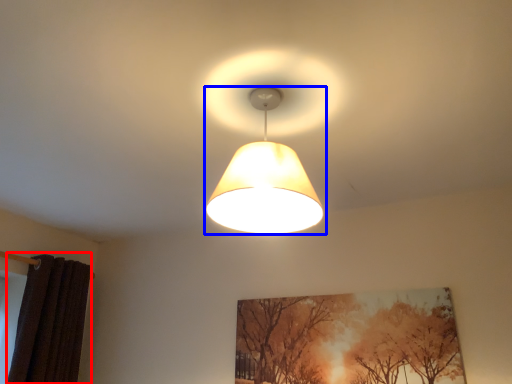
Question: Among these objects, which one is farthest to the camera, curtain (highlighted by a red box) or lamp (highlighted by a blue box)?

Choices:
 (A) curtain
 (B) lamp

Answer: (A)